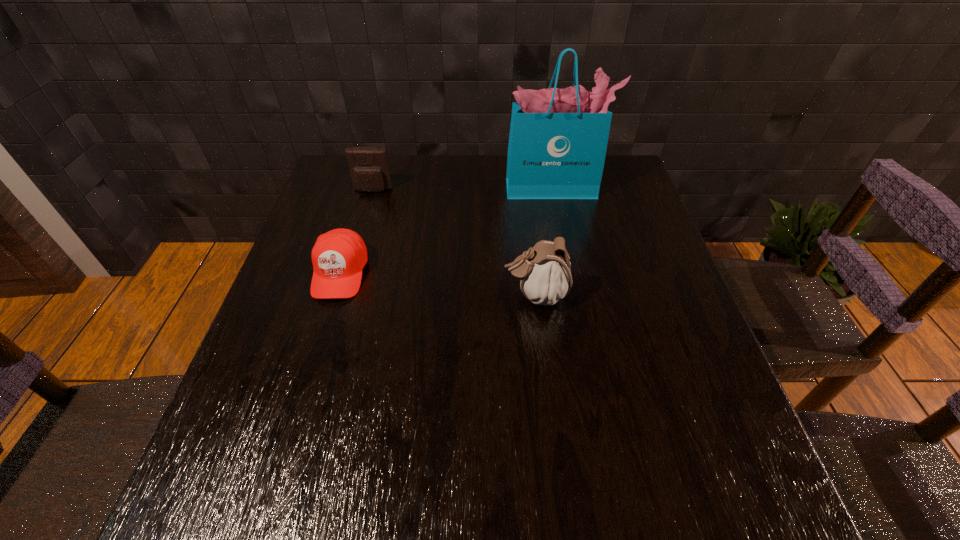
At what (x,y) coordinates should I click in order to perform the action: click on vacant region located with an open flap on the left pouch. Please return your answer as a coordinate pair (x, y). The width and height of the screenshot is (960, 540). Looking at the image, I should click on (350, 268).

Locate an element on the screen. blank space located on the front panel of the baseball cap is located at coordinates [320, 340].

Locate an element on the screen. shopping bag at the far edge is located at coordinates (558, 138).

This screenshot has height=540, width=960. What are the coordinates of `pouch located in the far edge section of the desktop` in the screenshot? It's located at (369, 168).

Find the location of a particular element. The image size is (960, 540). pouch positioned at the left edge is located at coordinates pos(369,168).

Where is `baseball cap that is positioned at the left edge`? This screenshot has height=540, width=960. baseball cap that is positioned at the left edge is located at coordinates (338, 257).

This screenshot has height=540, width=960. In order to click on object that is at the right edge in this screenshot , I will do `click(558, 138)`.

The image size is (960, 540). I want to click on object present at the far left corner, so click(369, 168).

The width and height of the screenshot is (960, 540). What are the coordinates of `object present at the far right corner` in the screenshot? It's located at (558, 138).

At what (x,y) coordinates should I click in order to perform the action: click on free location at the far edge. Please return your answer as a coordinate pair (x, y). The width and height of the screenshot is (960, 540). Looking at the image, I should click on (418, 178).